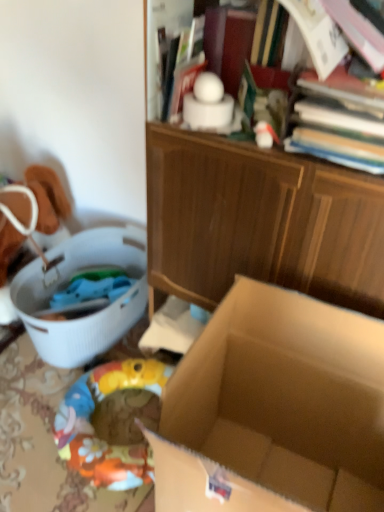
Question: Is brown cardboard box at center taller than white plastic laundry basket at left?

Choices:
 (A) no
 (B) yes

Answer: (B)

Question: Considering the relative sizes of brown cardboard box at center and white plastic laundry basket at left in the image provided, is brown cardboard box at center thinner than white plastic laundry basket at left?

Choices:
 (A) no
 (B) yes

Answer: (B)

Question: Is brown cardboard box at center further to camera compared to white plastic laundry basket at left?

Choices:
 (A) no
 (B) yes

Answer: (A)

Question: Is brown cardboard box at center positioned beyond the bounds of white plastic laundry basket at left?

Choices:
 (A) yes
 (B) no

Answer: (A)

Question: Can you confirm if brown cardboard box at center is positioned to the left of white plastic laundry basket at left?

Choices:
 (A) yes
 (B) no

Answer: (B)

Question: From a real-world perspective, does brown cardboard box at center stand above white plastic laundry basket at left?

Choices:
 (A) no
 (B) yes

Answer: (B)

Question: Can you confirm if hardcover book at upper right is taller than white plastic laundry basket at left?

Choices:
 (A) no
 (B) yes

Answer: (A)

Question: Are hardcover book at upper right and white plastic laundry basket at left making contact?

Choices:
 (A) yes
 (B) no

Answer: (B)

Question: From the image's perspective, does hardcover book at upper right appear lower than white plastic laundry basket at left?

Choices:
 (A) no
 (B) yes

Answer: (A)

Question: Is white plastic laundry basket at left located within hardcover book at upper right?

Choices:
 (A) no
 (B) yes

Answer: (A)

Question: Is hardcover book at upper right to the right of white plastic laundry basket at left from the viewer's perspective?

Choices:
 (A) no
 (B) yes

Answer: (B)

Question: From a real-world perspective, is hardcover book at upper right beneath white plastic laundry basket at left?

Choices:
 (A) no
 (B) yes

Answer: (A)

Question: Is white plastic laundry basket at left thinner than brown cardboard box at center?

Choices:
 (A) yes
 (B) no

Answer: (B)